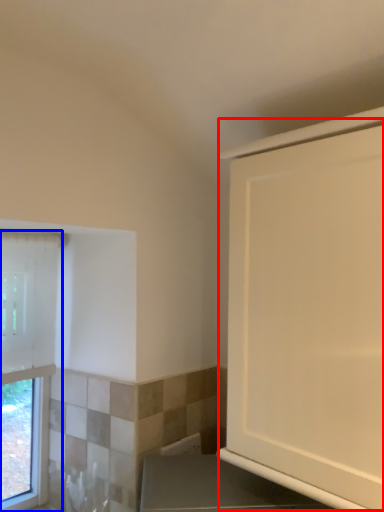
Question: Among these objects, which one is farthest to the camera, screen door (highlighted by a red box) or window (highlighted by a blue box)?

Choices:
 (A) screen door
 (B) window

Answer: (B)